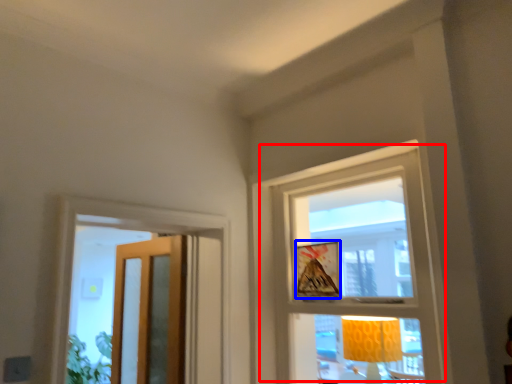
Question: Which object is closer to the camera taking this photo, window (highlighted by a red box) or picture frame (highlighted by a blue box)?

Choices:
 (A) window
 (B) picture frame

Answer: (A)